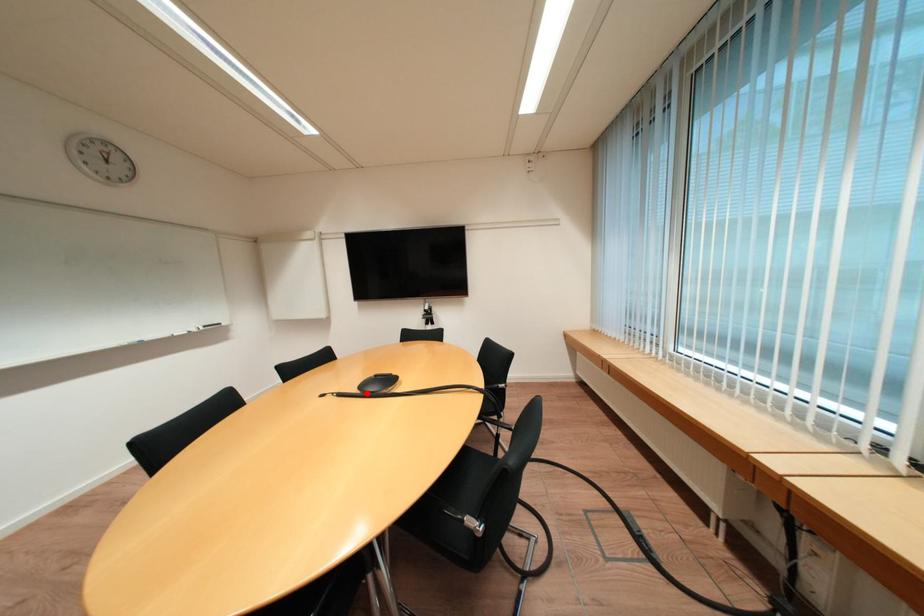
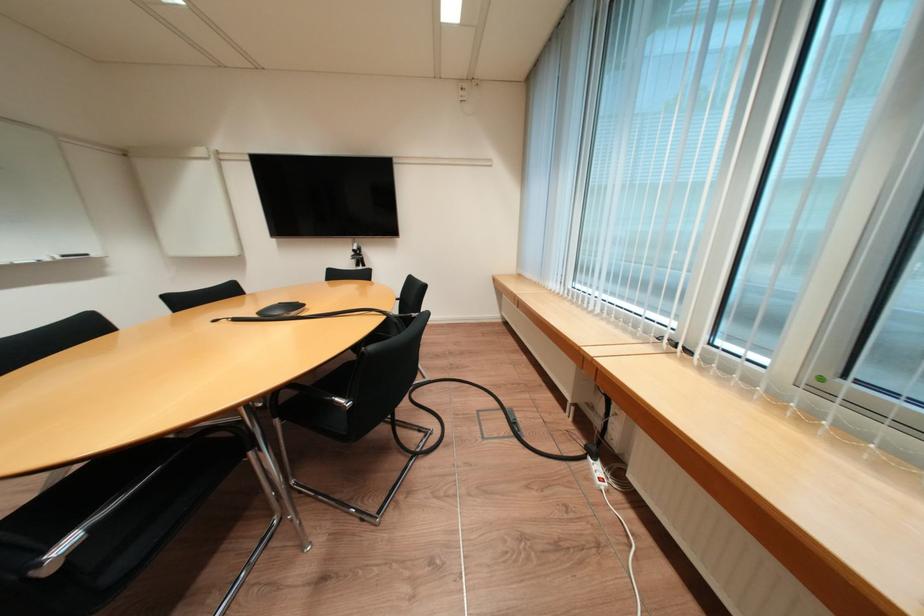
In the second image, find the point that corresponds to the highlighted location in the first image.

(265, 318)